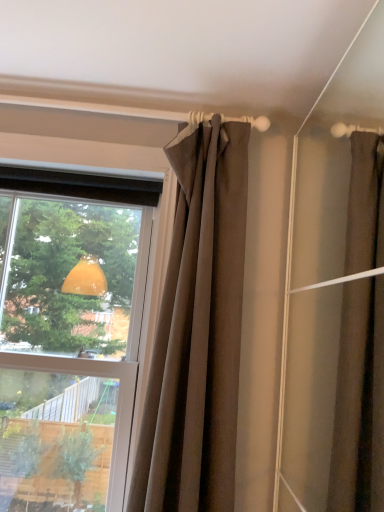
You are a GUI agent. You are given a task and a screenshot of the screen. Output one action in this format:
    pyautogui.click(x=<x>, y=<y>)
    Task: Click on the brown fabric curtain at upper center
    This screenshot has height=512, width=384.
    Given the screenshot: What is the action you would take?
    pyautogui.click(x=198, y=332)

This screenshot has height=512, width=384. Describe the element at coordinates (198, 332) in the screenshot. I see `brown fabric curtain at upper center` at that location.

The width and height of the screenshot is (384, 512). I want to click on transparent glass window at upper left, so click(x=68, y=349).

The width and height of the screenshot is (384, 512). Describe the element at coordinates (68, 349) in the screenshot. I see `transparent glass window at upper left` at that location.

Where is `brown fabric curtain at upper center`? The width and height of the screenshot is (384, 512). brown fabric curtain at upper center is located at coordinates (198, 332).

Considering the positions of objects brown fabric curtain at upper center and transparent glass window at upper left in the image provided, who is more to the left, brown fabric curtain at upper center or transparent glass window at upper left?

Positioned to the left is transparent glass window at upper left.

Considering their positions, is brown fabric curtain at upper center located in front of or behind transparent glass window at upper left?

brown fabric curtain at upper center is positioned closer to the viewer than transparent glass window at upper left.

Considering the points (215, 179) and (31, 501), which point is behind, point (215, 179) or point (31, 501)?

Positioned behind is point (31, 501).

From the image's perspective, is brown fabric curtain at upper center on top of transparent glass window at upper left?

Yes, from the image's perspective, brown fabric curtain at upper center is over transparent glass window at upper left.

From a real-world perspective, is brown fabric curtain at upper center above or below transparent glass window at upper left?

brown fabric curtain at upper center is above transparent glass window at upper left.

Is brown fabric curtain at upper center wider or thinner than transparent glass window at upper left?

In the image, brown fabric curtain at upper center appears to be more narrow than transparent glass window at upper left.

Can you confirm if brown fabric curtain at upper center is taller than transparent glass window at upper left?

Incorrect, the height of brown fabric curtain at upper center is not larger of that of transparent glass window at upper left.

Considering the relative sizes of brown fabric curtain at upper center and transparent glass window at upper left in the image provided, is brown fabric curtain at upper center smaller than transparent glass window at upper left?

Yes, brown fabric curtain at upper center is smaller than transparent glass window at upper left.

Would you say transparent glass window at upper left is part of brown fabric curtain at upper center's contents?

No, transparent glass window at upper left is located outside of brown fabric curtain at upper center.

Is brown fabric curtain at upper center next to transparent glass window at upper left and touching it?

No, brown fabric curtain at upper center is not in contact with transparent glass window at upper left.

Does brown fabric curtain at upper center turn towards transparent glass window at upper left?

No, brown fabric curtain at upper center is not facing towards transparent glass window at upper left.

How much distance is there between brown fabric curtain at upper center and transparent glass window at upper left?

A distance of 15.04 inches exists between brown fabric curtain at upper center and transparent glass window at upper left.

Locate an element on the screen. The height and width of the screenshot is (512, 384). curtain above the transparent glass window at upper left (from a real-world perspective) is located at coordinates (198, 332).

Is transparent glass window at upper left to the left or to the right of brown fabric curtain at upper center in the image?

In the image, transparent glass window at upper left appears on the left side of brown fabric curtain at upper center.

Is the position of transparent glass window at upper left less distant than that of brown fabric curtain at upper center?

No, transparent glass window at upper left is behind brown fabric curtain at upper center.

Is point (51, 339) more distant than point (184, 413)?

That is True.

From the image's perspective, is transparent glass window at upper left located above brown fabric curtain at upper center?

Incorrect, from the image's perspective, transparent glass window at upper left is lower than brown fabric curtain at upper center.

From a real-world perspective, is transparent glass window at upper left positioned over brown fabric curtain at upper center based on gravity?

No, from a real-world perspective, transparent glass window at upper left is not over brown fabric curtain at upper center

Looking at this image, which object is wider, transparent glass window at upper left or brown fabric curtain at upper center?

Wider between the two is transparent glass window at upper left.

Considering the relative sizes of transparent glass window at upper left and brown fabric curtain at upper center in the image provided, is transparent glass window at upper left taller than brown fabric curtain at upper center?

Correct, transparent glass window at upper left is much taller as brown fabric curtain at upper center.

In terms of size, does transparent glass window at upper left appear bigger or smaller than brown fabric curtain at upper center?

Considering their sizes, transparent glass window at upper left takes up more space than brown fabric curtain at upper center.

Choose the correct answer: Is transparent glass window at upper left inside brown fabric curtain at upper center or outside it?

transparent glass window at upper left exists outside the volume of brown fabric curtain at upper center.

Is transparent glass window at upper left not near brown fabric curtain at upper center?

No, transparent glass window at upper left is not far from brown fabric curtain at upper center.

Is transparent glass window at upper left looking in the opposite direction of brown fabric curtain at upper center?

No, transparent glass window at upper left is not facing the opposite direction of brown fabric curtain at upper center.

What's the angular difference between transparent glass window at upper left and brown fabric curtain at upper center's facing directions?

0.00131 degrees separate the facing orientations of transparent glass window at upper left and brown fabric curtain at upper center.

How distant is transparent glass window at upper left from brown fabric curtain at upper center?

The distance of transparent glass window at upper left from brown fabric curtain at upper center is 15.04 inches.

Identify the location of curtain lying in front of the transparent glass window at upper left. (198, 332).

At what (x,y) coordinates should I click in order to perform the action: click on curtain in front of the transparent glass window at upper left. Please return your answer as a coordinate pair (x, y). The image size is (384, 512). Looking at the image, I should click on (198, 332).

Where is `curtain that appears on the right of transparent glass window at upper left`? curtain that appears on the right of transparent glass window at upper left is located at coordinates (198, 332).